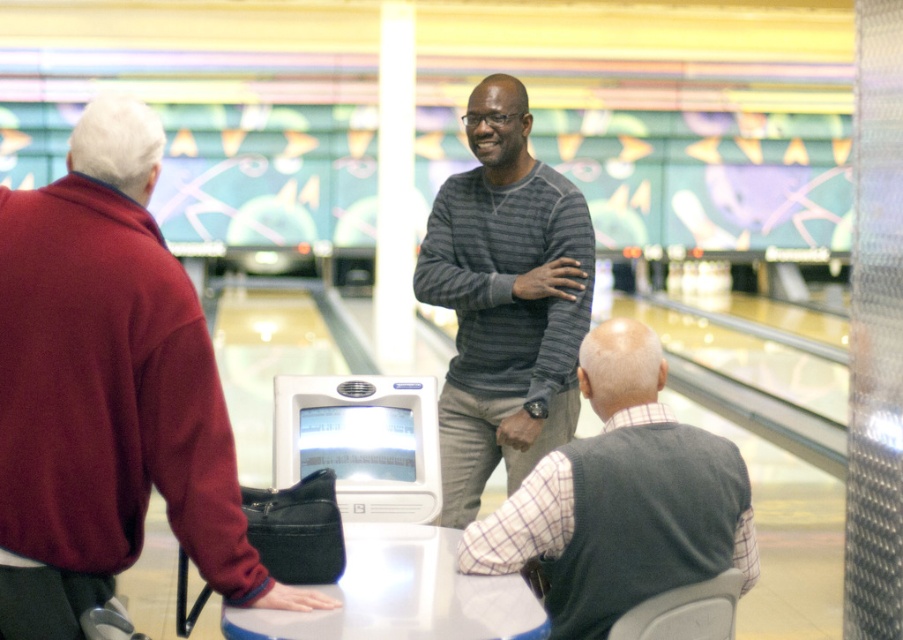
The height and width of the screenshot is (640, 903). What are the coordinates of `maroon sweater at center` in the screenshot? It's located at (108, 392).

Based on the photo, is maroon sweater at center to the right of gray sweater at center from the viewer's perspective?

Incorrect, maroon sweater at center is not on the right side of gray sweater at center.

Locate an element on the screen. This screenshot has height=640, width=903. maroon sweater at center is located at coordinates (108, 392).

Is the position of striped sweater at center more distant than that of gray sweater at center?

That is True.

This screenshot has width=903, height=640. I want to click on striped sweater at center, so click(505, 300).

Is point (194, 547) more distant than point (473, 276)?

No, (194, 547) is closer to viewer.

Consider the image. Does maroon sweater at center have a lesser height compared to striped sweater at center?

Yes, maroon sweater at center is shorter than striped sweater at center.

Locate an element on the screen. maroon sweater at center is located at coordinates (108, 392).

Locate an element on the screen. maroon sweater at center is located at coordinates (108, 392).